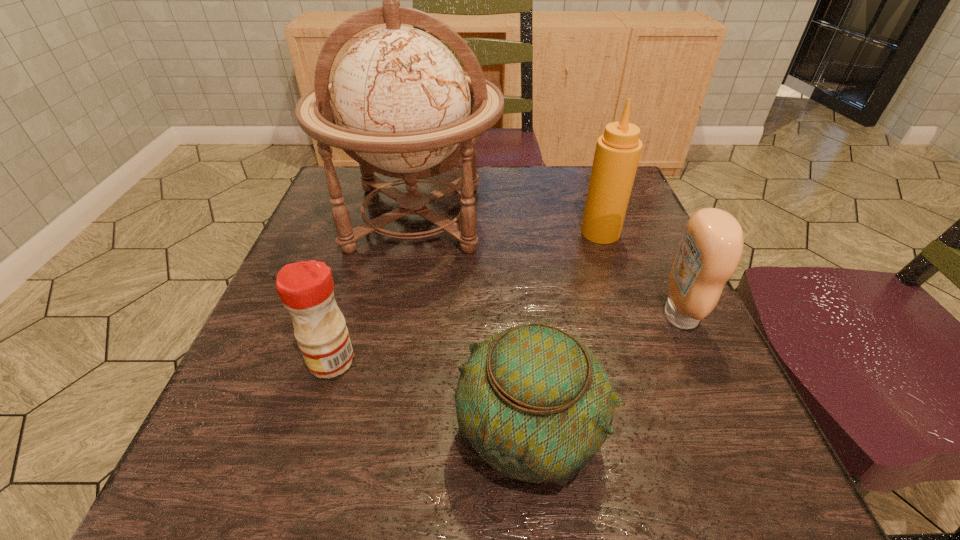
Find the location of `free space between the globe and the second condiment from right to left`. free space between the globe and the second condiment from right to left is located at coordinates (508, 225).

Identify which object is the third nearest to the globe. Please provide its 2D coordinates. Your answer should be formatted as a tuple, i.e. [(x, y)], where the tuple contains the x and y coordinates of a point satisfying the conditions above.

[(536, 404)]

Identify which object is the fourth nearest to the nearest condiment. Please provide its 2D coordinates. Your answer should be formatted as a tuple, i.e. [(x, y)], where the tuple contains the x and y coordinates of a point satisfying the conditions above.

[(711, 247)]

Select which condiment appears as the third closest to the globe. Please provide its 2D coordinates. Your answer should be formatted as a tuple, i.e. [(x, y)], where the tuple contains the x and y coordinates of a point satisfying the conditions above.

[(711, 247)]

Identify which condiment is the nearest to the second condiment from left to right. Please provide its 2D coordinates. Your answer should be formatted as a tuple, i.e. [(x, y)], where the tuple contains the x and y coordinates of a point satisfying the conditions above.

[(711, 247)]

Identify the location of vacant area in the image that satisfies the following two spatial constraints: 1. on the back side of the nearest condiment; 2. on the left side of the farthest condiment. The width and height of the screenshot is (960, 540). (372, 233).

The image size is (960, 540). I want to click on free space that satisfies the following two spatial constraints: 1. at the front of the globe showing Africa; 2. on the right side of the second tallest object, so click(413, 233).